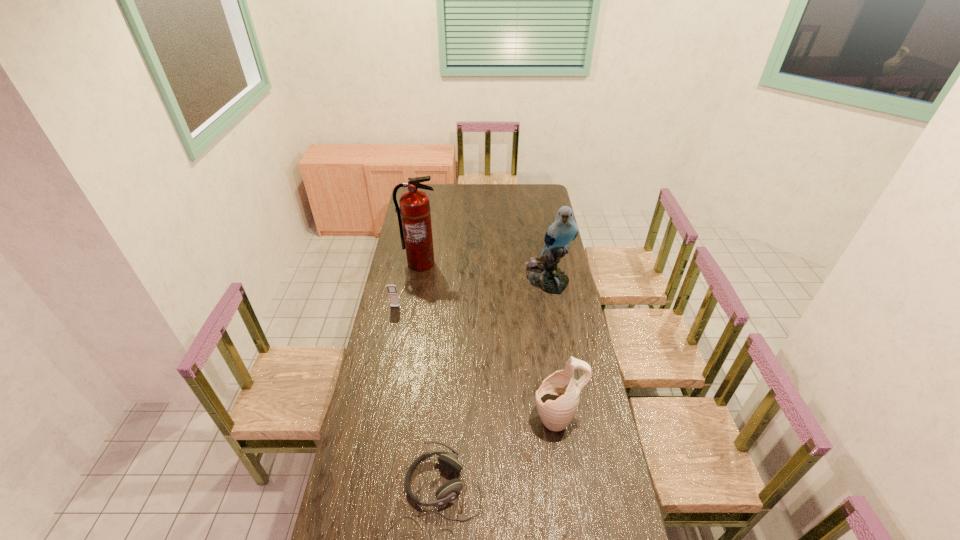
Where is `free region that satisfies the following two spatial constraints: 1. on the face of the parakeet; 2. at the spout of the pitcher`? free region that satisfies the following two spatial constraints: 1. on the face of the parakeet; 2. at the spout of the pitcher is located at coordinates (571, 418).